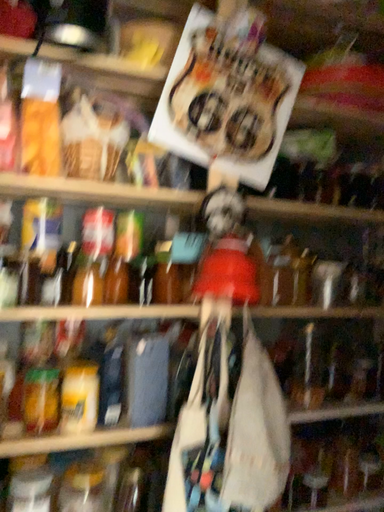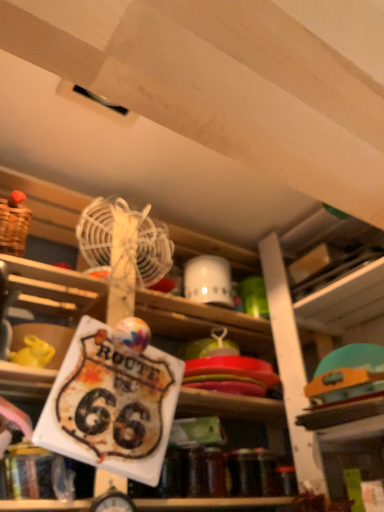
Question: Which way did the camera rotate in the video?

Choices:
 (A) rotated right
 (B) rotated left

Answer: (A)